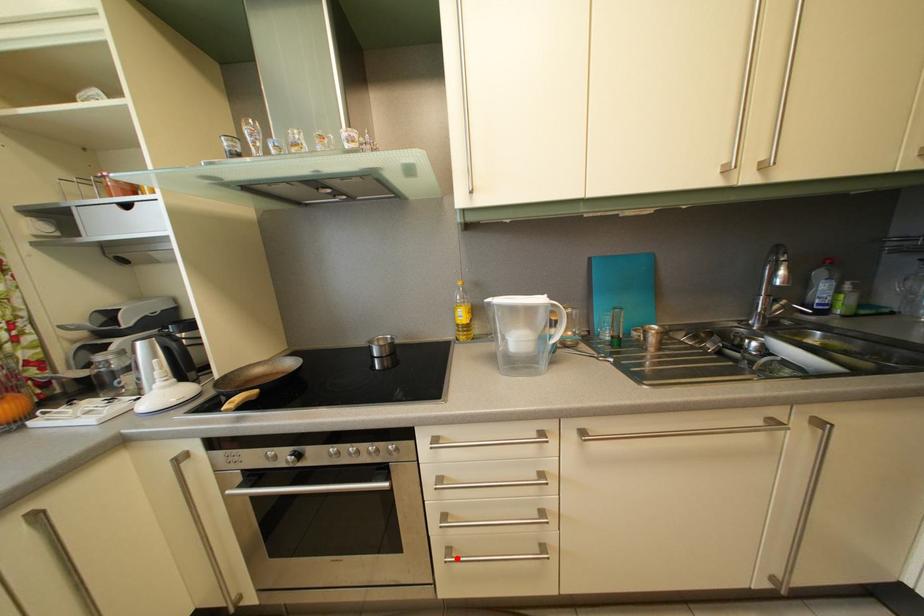
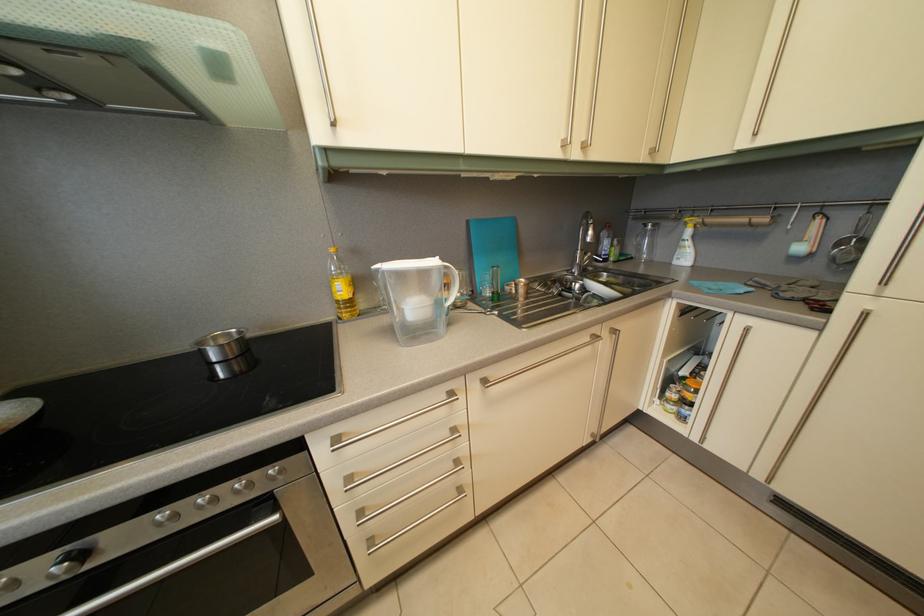
Find the pixel in the second image that matches the highlighted location in the first image.

(380, 549)